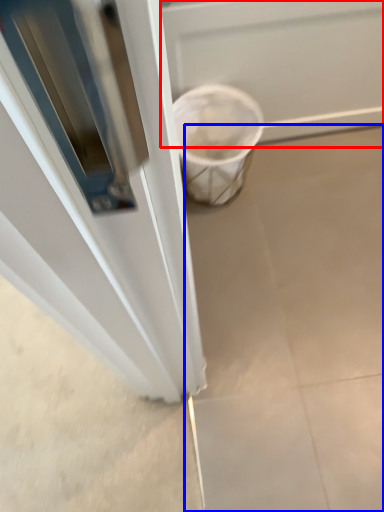
Question: Which object appears closest to the camera in this image, screen door (highlighted by a red box) or concrete (highlighted by a blue box)?

Choices:
 (A) screen door
 (B) concrete

Answer: (A)